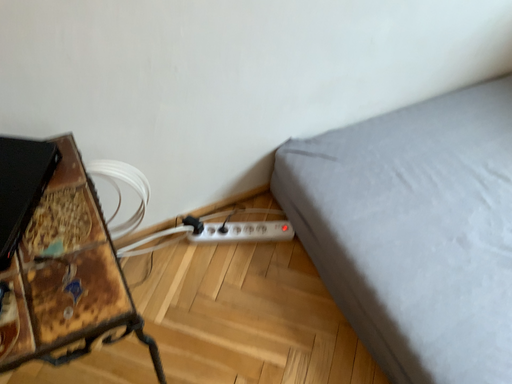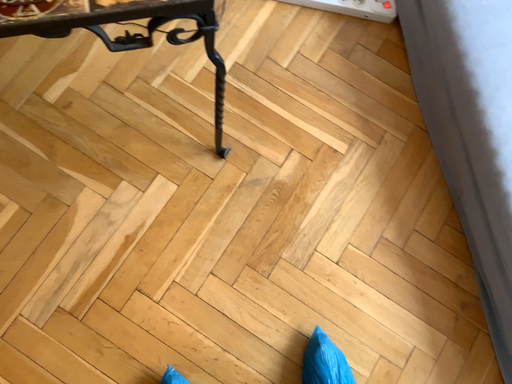
Question: How did the camera likely rotate when shooting the video?

Choices:
 (A) rotated left
 (B) rotated right

Answer: (A)